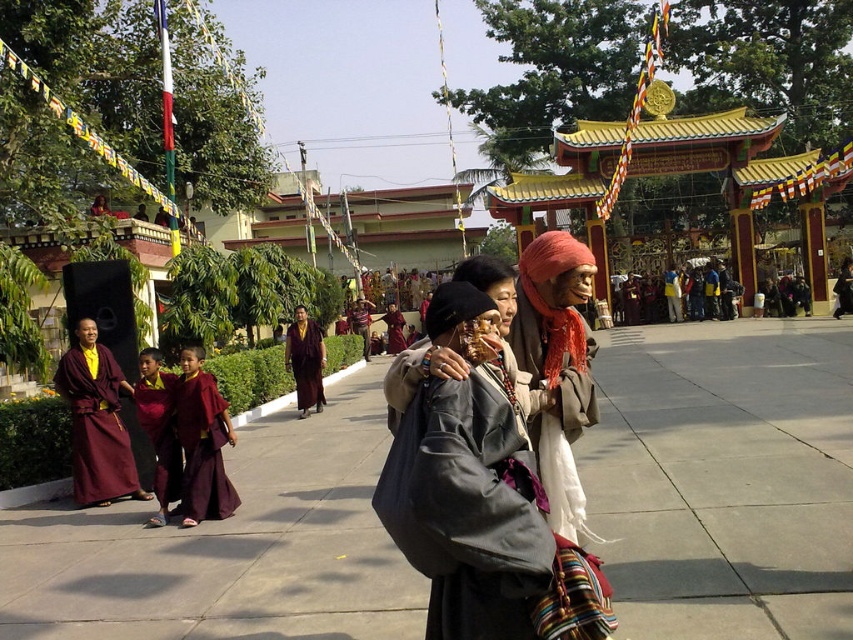
Can you confirm if gray concrete pavement at center is smaller than maroon silk robe at center?

No.

Who is more distant from viewer, (634, 404) or (321, 344)?

The point (321, 344) is more distant.

Identify the location of gray concrete pavement at center. pos(724,477).

Which is in front, point (833, 492) or point (422, 380)?

Point (422, 380) is in front.

Which is above, gray concrete pavement at center or gray woolen robe at center?

Positioned higher is gray woolen robe at center.

Find the location of a particular element. This screenshot has width=853, height=640. gray concrete pavement at center is located at coordinates (724, 477).

Looking at this image, how far apart are white cotton robe at center and maroon silk robe at lower left?

A distance of 3.73 meters exists between white cotton robe at center and maroon silk robe at lower left.

Is point (573, 486) positioned in front of point (210, 406)?

Yes, point (573, 486) is in front of point (210, 406).

Is point (546, 428) positioned behind point (210, 385)?

No, (546, 428) is in front of (210, 385).

The width and height of the screenshot is (853, 640). In order to click on white cotton robe at center in this screenshot , I will do `click(555, 401)`.